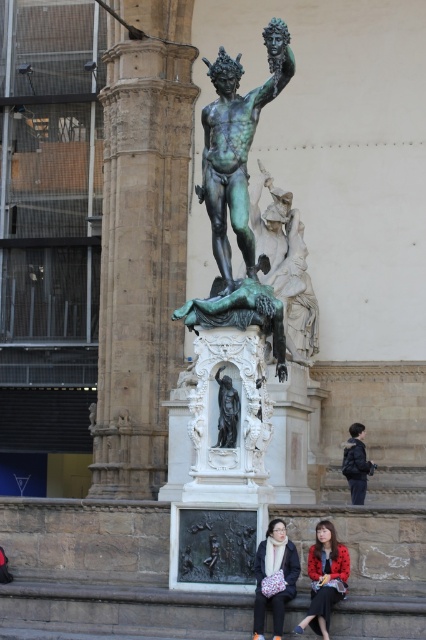
Between point (317, 596) and point (273, 624), which one is positioned behind?

The point (273, 624) is behind.

Between red textured coat at lower center and matte black coat at lower center, which one has more height?

With more height is matte black coat at lower center.

This screenshot has width=426, height=640. I want to click on red textured coat at lower center, so click(325, 579).

Which is above, red textured coat at lower center or black polished statue at center?

black polished statue at center is above.

Is point (331, 563) less distant than point (233, 429)?

That is True.

This screenshot has width=426, height=640. I want to click on red textured coat at lower center, so click(x=325, y=579).

Can you confirm if bronze statue at center is positioned to the left of red textured coat at lower center?

Correct, you'll find bronze statue at center to the left of red textured coat at lower center.

Is bronze statue at center smaller than red textured coat at lower center?

Actually, bronze statue at center might be larger than red textured coat at lower center.

Who is more forward, (224, 244) or (345, 564)?

Point (345, 564) is in front.

Locate an element on the screen. This screenshot has width=426, height=640. bronze statue at center is located at coordinates (236, 147).